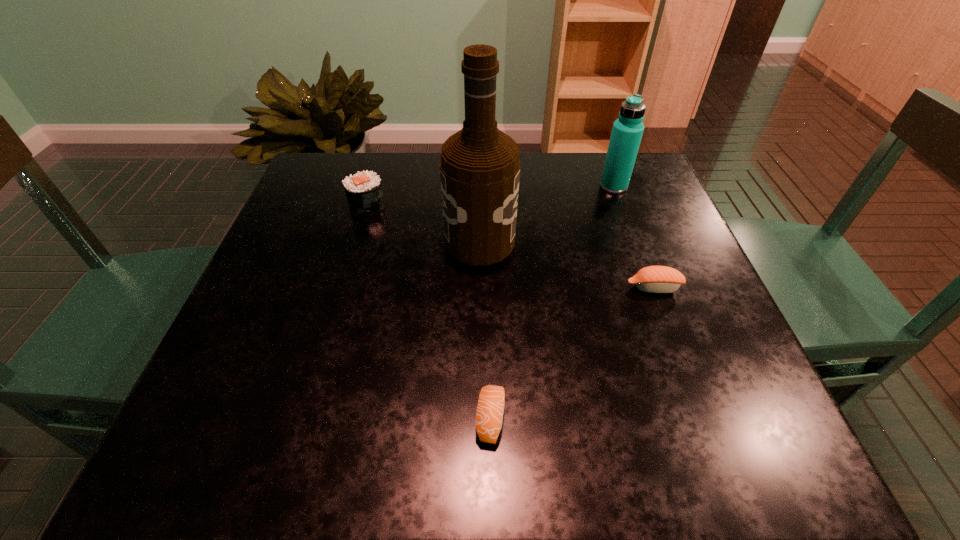
At what (x,y) coordinates should I click in order to perform the action: click on sushi that is at the right edge. Please return your answer as a coordinate pair (x, y). Image resolution: width=960 pixels, height=540 pixels. Looking at the image, I should click on (654, 279).

Locate an element on the screen. This screenshot has width=960, height=540. object that is at the far left corner is located at coordinates (363, 190).

The width and height of the screenshot is (960, 540). I want to click on object located at the far right corner, so click(x=627, y=131).

Find the location of `vacant space at the far edge of the desktop`. vacant space at the far edge of the desktop is located at coordinates (374, 165).

The width and height of the screenshot is (960, 540). What are the coordinates of `vacant space at the left edge` in the screenshot? It's located at (324, 248).

Where is `free space at the right edge`? free space at the right edge is located at coordinates (646, 240).

This screenshot has height=540, width=960. In order to click on vacant space at the far left corner of the desktop in this screenshot , I will do tap(316, 156).

You are a GUI agent. You are given a task and a screenshot of the screen. Output one action in this format:
    pyautogui.click(x=<x>, y=<y>)
    Task: Click on the vacant region between the alcohol and the nearest sushi
    The height and width of the screenshot is (540, 960).
    Given the screenshot: What is the action you would take?
    pyautogui.click(x=485, y=330)

What are the coordinates of `vacant area that lies between the fourth tallest object and the shortest sushi` in the screenshot? It's located at point(572,353).

What are the coordinates of `blank region between the second tallest sushi and the water bottle` in the screenshot? It's located at (634, 237).